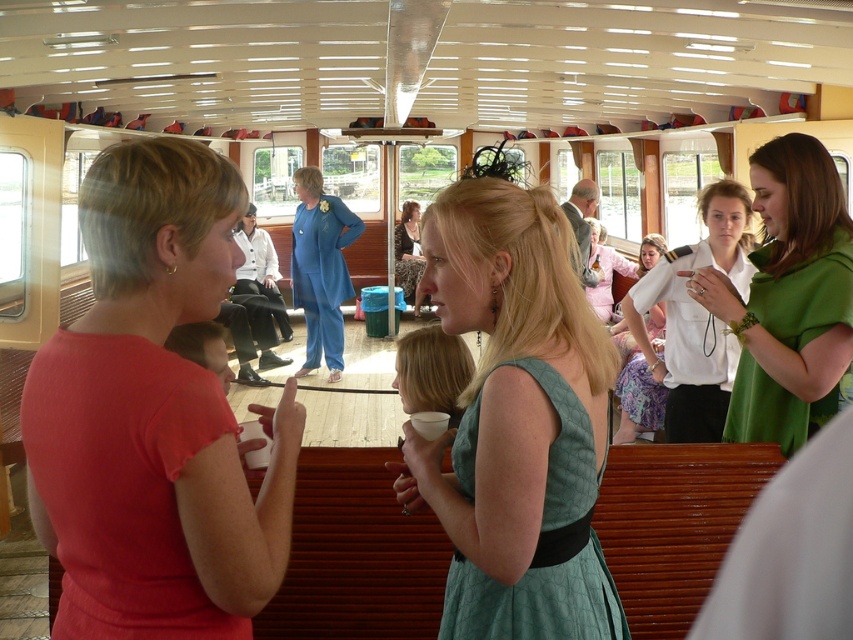
You are at a social event on a boat and see two women wearing a teal satin dress at center and a green fabric dress at center. Which woman is standing to the left of the other?

The teal satin dress at center is positioned on the left side of green fabric dress at center, so the woman wearing the teal satin dress at center is standing to the left of the woman in the green fabric dress at center.

You are standing at the entrance of the boat and want to find the teal satin dress at center. According to the coordinates provided, in which direction should you look to locate it?

The teal satin dress at center is located at coordinates point (517, 422), so you should look towards the center of the boat to find it.

Based on the photo, you are a photographer trying to capture the two dresses in the scene. Which dress is closer to the camera, the floral fabric dress at center or the patterned fabric dress at center?

The floral fabric dress at center is positioned under the patterned fabric dress at center, so the patterned fabric dress at center is closer to the camera.